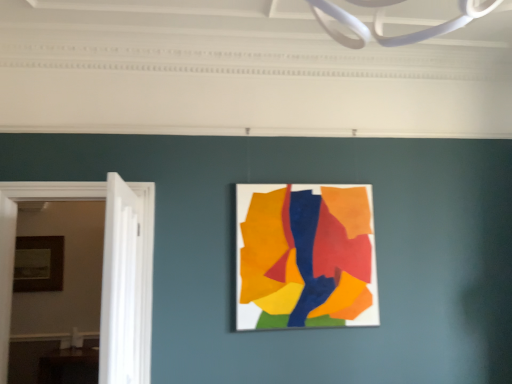
Question: From a real-world perspective, is wooden picture frame at left, placed as the 1th picture frame when sorted from left to right, located higher than white wooden door at left?

Choices:
 (A) no
 (B) yes

Answer: (B)

Question: From the image's perspective, is wooden picture frame at left, arranged as the second picture frame when viewed from the right, under white wooden door at left?

Choices:
 (A) yes
 (B) no

Answer: (A)

Question: Does wooden picture frame at left, placed as the 1th picture frame when sorted from left to right, appear on the left side of white wooden door at left?

Choices:
 (A) yes
 (B) no

Answer: (A)

Question: Can you confirm if wooden picture frame at left, arranged as the 1th picture frame when viewed from the back, is bigger than white wooden door at left?

Choices:
 (A) yes
 (B) no

Answer: (B)

Question: Could you tell me if wooden picture frame at left, which ranks as the second picture frame in front-to-back order, is turned towards white wooden door at left?

Choices:
 (A) yes
 (B) no

Answer: (A)

Question: From the image's perspective, would you say wooden picture frame at left, arranged as the second picture frame when viewed from the right, is positioned over white wooden door at left?

Choices:
 (A) yes
 (B) no

Answer: (B)

Question: From the image's perspective, is white wooden door at left below wooden picture frame at left, which ranks as the second picture frame in front-to-back order?

Choices:
 (A) no
 (B) yes

Answer: (A)

Question: Does white wooden door at left lie in front of wooden picture frame at left, which ranks as the second picture frame in front-to-back order?

Choices:
 (A) yes
 (B) no

Answer: (A)

Question: From a real-world perspective, is white wooden door at left under wooden picture frame at left, arranged as the second picture frame when viewed from the right?

Choices:
 (A) yes
 (B) no

Answer: (A)

Question: Is white wooden door at left turned away from wooden picture frame at left, placed as the 1th picture frame when sorted from left to right?

Choices:
 (A) yes
 (B) no

Answer: (B)

Question: Can you confirm if white wooden door at left is positioned to the right of wooden picture frame at left, which ranks as the second picture frame in front-to-back order?

Choices:
 (A) yes
 (B) no

Answer: (A)

Question: From a real-world perspective, is white wooden door at left over wooden picture frame at left, placed as the 1th picture frame when sorted from left to right?

Choices:
 (A) no
 (B) yes

Answer: (A)

Question: Considering the relative sizes of matte paper collage at center, which is the 2th picture frame in left-to-right order, and wooden picture frame at left, which ranks as the second picture frame in front-to-back order, in the image provided, is matte paper collage at center, which is the 2th picture frame in left-to-right order, smaller than wooden picture frame at left, which ranks as the second picture frame in front-to-back order,?

Choices:
 (A) yes
 (B) no

Answer: (B)